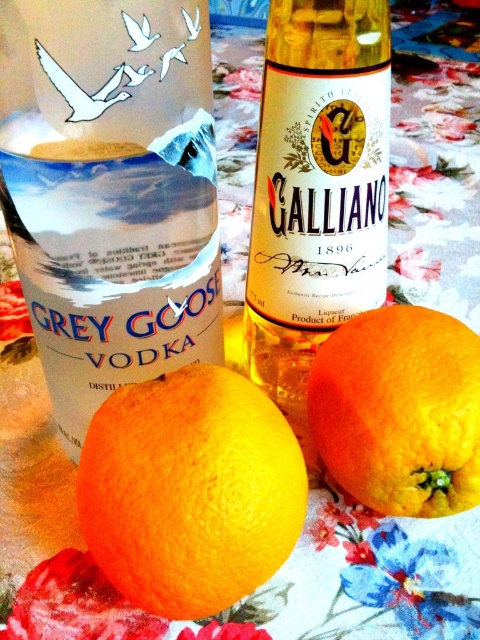
Consider the image. You are a bartender preparing a cocktail that requires equal volumes of vodka and orange juice. You have the yellow glass bottle at center and the orangesmoothorange at right. Which object will you use to measure the vodka, and why?

The yellow glass bottle at center contains the vodka because it is larger in size than the orangesmoothorange at right, which is the orange used for juice.

You are arranging drinks at a bar and need to place a new bottle between the yellow glass bottle at center and the orangesmoothorange at right. According to the current setup, where should you position the new bottle?

The yellow glass bottle at center is to the left of orangesmoothorange at right, so you should place the new bottle between them to the right of the yellow glass bottle at center and to the left of the orangesmoothorange at right.